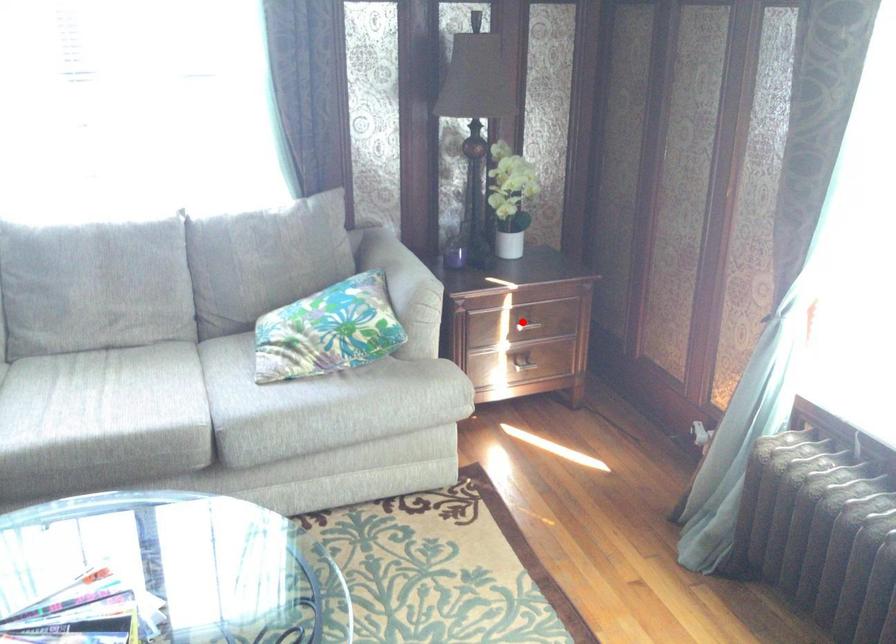
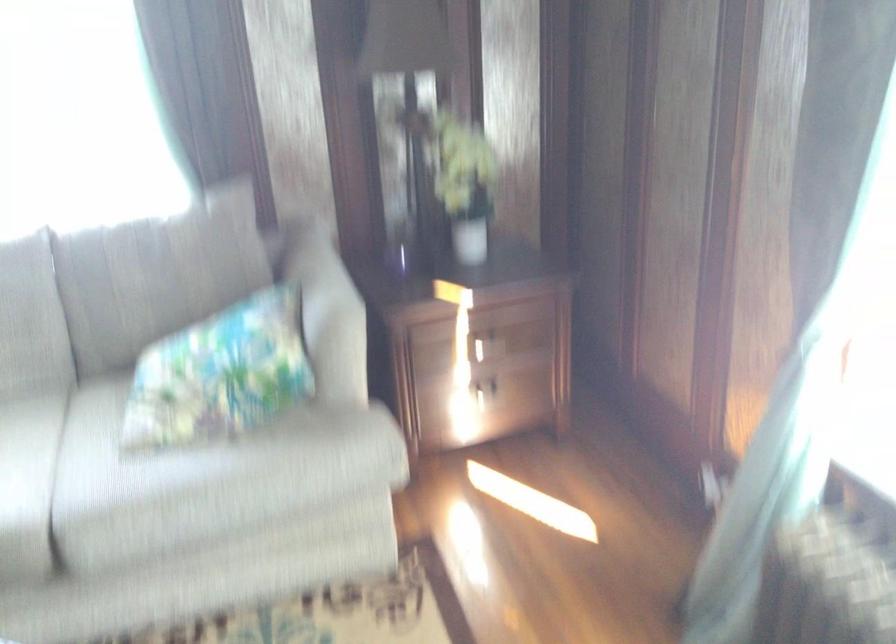
Question: I am providing you with two images of the same scene from different viewpoints. A red point is marked on the first image. Can you still see the location of the red point in image 2?

Choices:
 (A) Yes
 (B) No

Answer: (A)